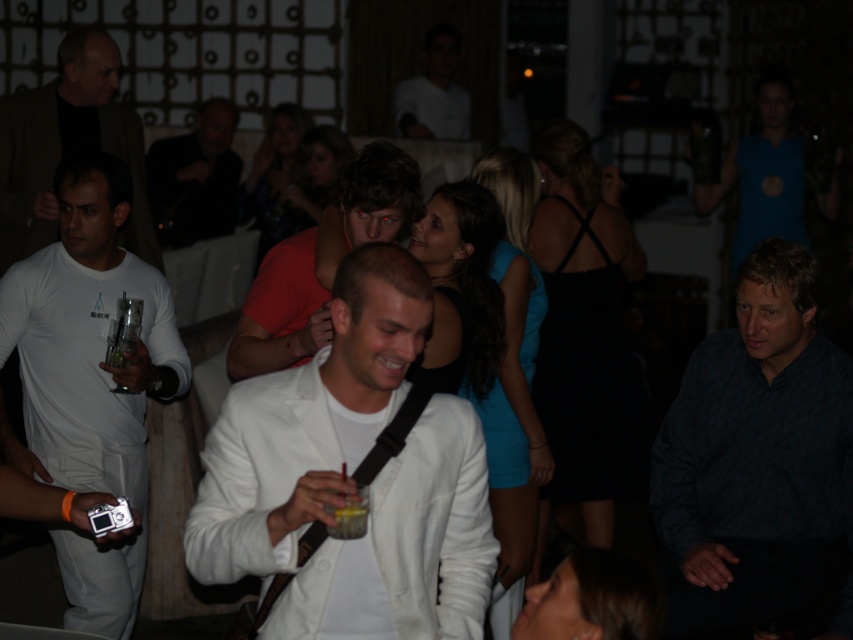
Question: Does white matte jacket at center have a lesser width compared to dark blue textured shirt at center?

Choices:
 (A) yes
 (B) no

Answer: (B)

Question: Which object appears farthest from the camera in this image?

Choices:
 (A) white matte t-shirt at left
 (B) white matte jacket at center
 (C) dark brown leather jacket at upper center

Answer: (C)

Question: Among these objects, which one is nearest to the camera?

Choices:
 (A) smooth white shirt at upper center
 (B) white matte t-shirt at left

Answer: (B)

Question: Where is white matte jacket at center located in relation to matte red shirt at center in the image?

Choices:
 (A) left
 (B) right

Answer: (B)

Question: Is dark blue textured shirt at center further to the viewer compared to dark brown leather jacket at upper center?

Choices:
 (A) no
 (B) yes

Answer: (A)

Question: Which of the following is the farthest from the observer?

Choices:
 (A) (68, 246)
 (B) (15, 113)
 (C) (202, 531)
 (D) (786, 321)

Answer: (B)